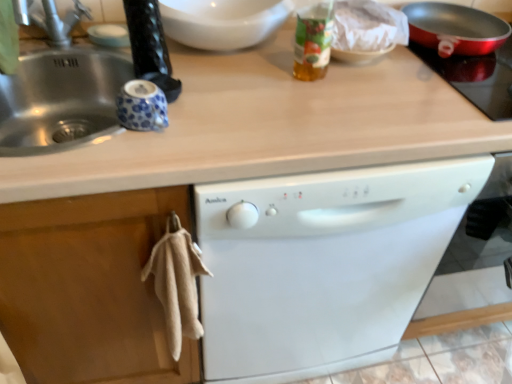
Find the location of `spots to the right of translucent plastic bottle at upper center`. spots to the right of translucent plastic bottle at upper center is located at coordinates (387, 90).